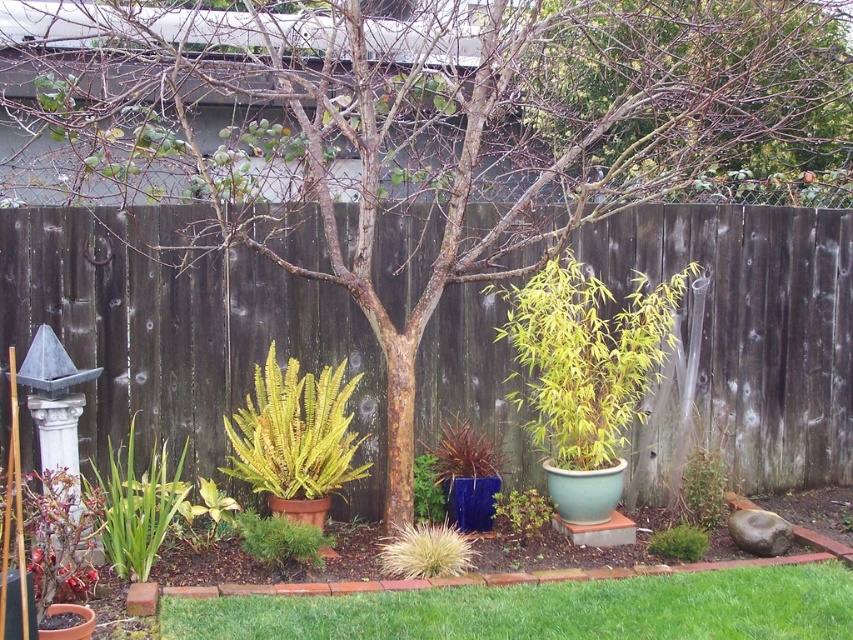
Question: Based on their relative distances, which object is farther from the green matte plant at center?

Choices:
 (A) matte brown pot at lower left
 (B) blue ceramic vase at center
 (C) matte blue pot at center-right

Answer: (C)

Question: Does blue ceramic vase at center appear on the left side of green matte plant at center?

Choices:
 (A) no
 (B) yes

Answer: (A)

Question: Estimate the real-world distances between objects in this image. Which object is farther from the green matte plant at center?

Choices:
 (A) matte brown pot at lower left
 (B) blue ceramic vase at center

Answer: (A)

Question: Does matte brown pot at lower left lie behind green matte plant at center?

Choices:
 (A) no
 (B) yes

Answer: (A)

Question: Is the position of matte blue pot at center-right less distant than that of green matte plant at center?

Choices:
 (A) yes
 (B) no

Answer: (B)

Question: Which object is the closest to the green matte plant at center?

Choices:
 (A) blue ceramic vase at center
 (B) matte brown pot at lower left

Answer: (A)